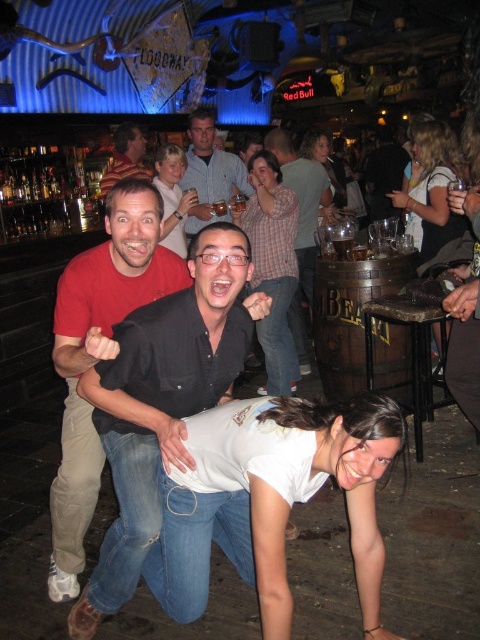
You are a photographer trying to capture a candid shot of the matte black shirt at center and the striped shirt at upper left. Which of the two shirts should you focus on to ensure it takes up more of your camera frame?

The striped shirt at upper left occupies more space in the image, so focusing on it would ensure it takes up more of the camera frame.